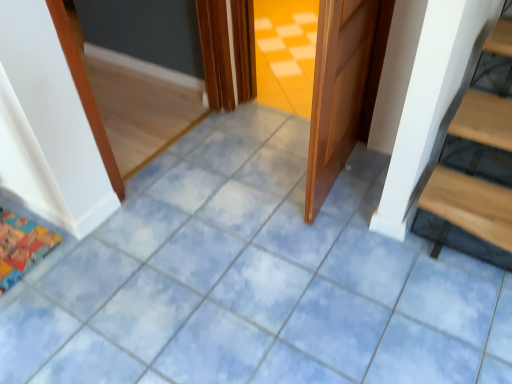
This screenshot has height=384, width=512. Identify the location of free space above cartoon fabric mat at lower left (from a real-world perspective). (16, 240).